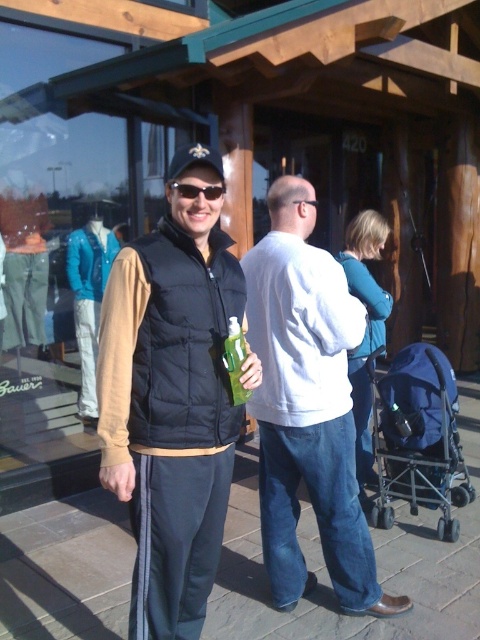
Is black puffer vest at center further to camera compared to teal sweater at center?

That is False.

How distant is black puffer vest at center from teal sweater at center?

black puffer vest at center is 1.43 meters away from teal sweater at center.

Between point (208, 230) and point (373, 332), which one is positioned in front?

Point (208, 230) is in front.

Locate an element on the screen. black puffer vest at center is located at coordinates (171, 396).

Who is taller, white cotton shirt at center or blue fabric stroller at lower right?

Standing taller between the two is white cotton shirt at center.

Who is positioned more to the right, white cotton shirt at center or blue fabric stroller at lower right?

From the viewer's perspective, blue fabric stroller at lower right appears more on the right side.

Is point (283, 288) positioned in front of point (397, 496)?

That is True.

Where is `white cotton shirt at center`? The height and width of the screenshot is (640, 480). white cotton shirt at center is located at coordinates (308, 406).

Who is more distant from viewer, (216, 314) or (402, 428)?

Point (402, 428)

Who is more forward, (x=106, y=413) or (x=425, y=490)?

Positioned in front is point (x=106, y=413).

At what (x,y) coordinates should I click in order to perform the action: click on black puffer vest at center. Please return your answer as a coordinate pair (x, y). Looking at the image, I should click on (171, 396).